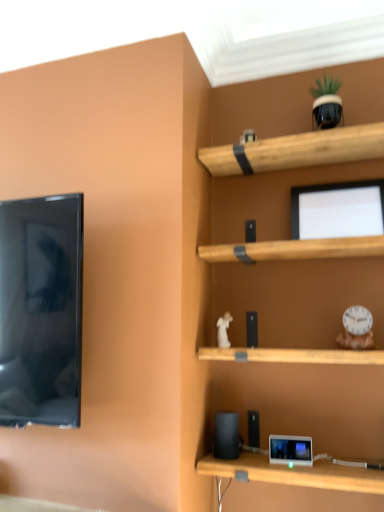
Question: Is green matte plant pot at upper right, the 1th toy when ordered from top to bottom, turned away from matte black tablet at lower center?

Choices:
 (A) no
 (B) yes

Answer: (A)

Question: From the image's perspective, does green matte plant pot at upper right, the 2th toy from the left, appear lower than matte black tablet at lower center?

Choices:
 (A) no
 (B) yes

Answer: (A)

Question: Does green matte plant pot at upper right, the 2th toy from the left, have a lesser height compared to matte black tablet at lower center?

Choices:
 (A) yes
 (B) no

Answer: (B)

Question: Does green matte plant pot at upper right, the 2th toy from the left, come behind matte black tablet at lower center?

Choices:
 (A) no
 (B) yes

Answer: (B)

Question: Does green matte plant pot at upper right, the 3th toy from the bottom, have a lesser width compared to matte black tablet at lower center?

Choices:
 (A) yes
 (B) no

Answer: (B)

Question: Relative to green matte plant pot at upper right, the 1th toy when ordered from top to bottom, is matte black monitor at upper center in front or behind?

Choices:
 (A) front
 (B) behind

Answer: (B)

Question: In terms of width, does matte black monitor at upper center look wider or thinner when compared to green matte plant pot at upper right, the 2th toy from the left?

Choices:
 (A) thin
 (B) wide

Answer: (A)

Question: Is point (347, 199) closer or farther from the camera than point (332, 82)?

Choices:
 (A) closer
 (B) farther

Answer: (A)

Question: From the image's perspective, is matte black monitor at upper center located above or below green matte plant pot at upper right, the 2th toy from the left?

Choices:
 (A) above
 (B) below

Answer: (B)

Question: From the image's perspective, is black matte speaker at lower center above or below matte black monitor at upper center?

Choices:
 (A) above
 (B) below

Answer: (B)

Question: Is black matte speaker at lower center taller or shorter than matte black monitor at upper center?

Choices:
 (A) tall
 (B) short

Answer: (B)

Question: Looking at the image, does black matte speaker at lower center seem bigger or smaller compared to matte black monitor at upper center?

Choices:
 (A) big
 (B) small

Answer: (B)

Question: In the image, is black matte speaker at lower center on the left side or the right side of matte black monitor at upper center?

Choices:
 (A) left
 (B) right

Answer: (A)

Question: From their relative heights in the image, would you say white plastic clock at right, which appears as the third toy when viewed from the left, is taller or shorter than matte black tablet at lower center?

Choices:
 (A) short
 (B) tall

Answer: (B)

Question: Choose the correct answer: Is white plastic clock at right, which is the first toy in right-to-left order, inside matte black tablet at lower center or outside it?

Choices:
 (A) inside
 (B) outside

Answer: (B)